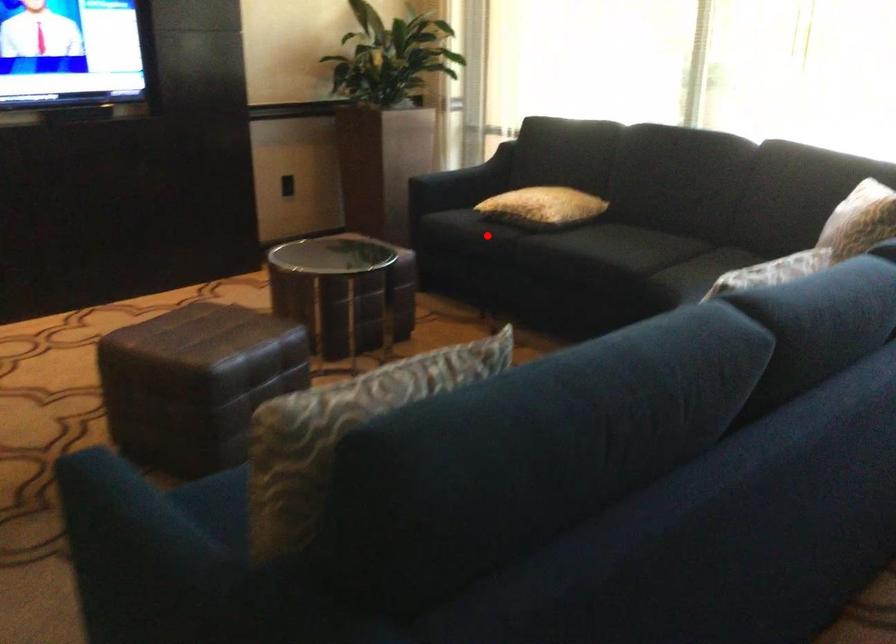
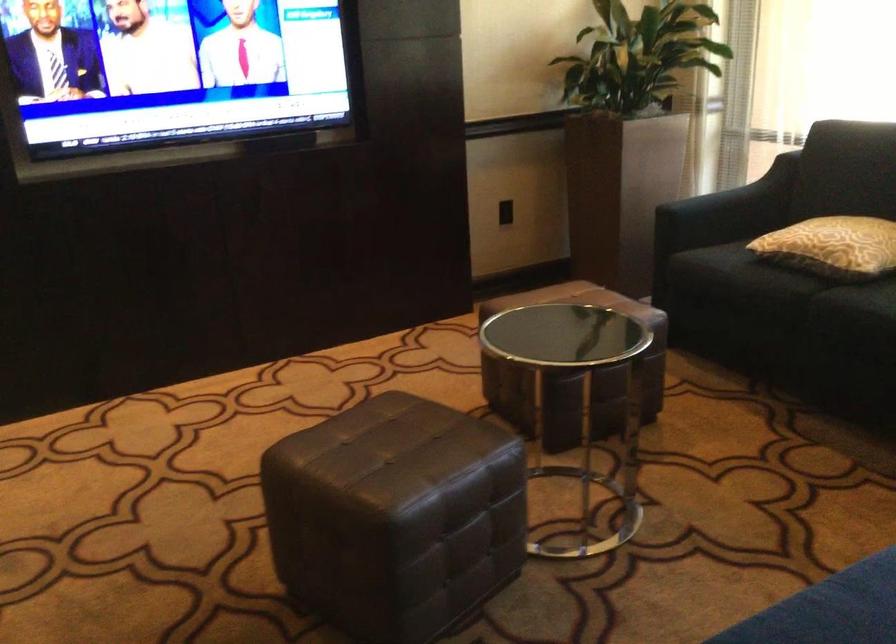
Question: I am providing you with two images of the same scene from different viewpoints. Image1 has a red point marked. In image2, the corresponding 3D location appears at what relative position? Reply with the corresponding letter.

Choices:
 (A) Closer
 (B) Farther

Answer: (A)